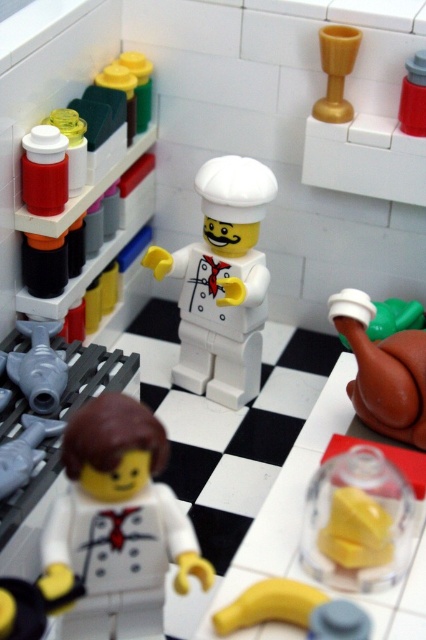
Does smooth white chef at center have a larger size compared to gold plastic cup at upper center?

Correct, smooth white chef at center is larger in size than gold plastic cup at upper center.

Is smooth white chef at center positioned before gold plastic cup at upper center?

Yes, it is.

Image resolution: width=426 pixels, height=640 pixels. In order to click on smooth white chef at center in this screenshot , I will do `click(118, 518)`.

Can you confirm if brown matte turkey at right is smaller than gold plastic cup at upper center?

No, brown matte turkey at right is not smaller than gold plastic cup at upper center.

Can you confirm if brown matte turkey at right is shorter than gold plastic cup at upper center?

→ No, brown matte turkey at right is not shorter than gold plastic cup at upper center.

Who is more forward, (411, 353) or (351, 67)?

Point (411, 353)

Find the location of a particular element. Image resolution: width=426 pixels, height=640 pixels. brown matte turkey at right is located at coordinates (382, 371).

Is white matte chef hat at center bigger than yellow rubber glove at lower left?

Yes.

Does white matte chef hat at center have a lesser height compared to yellow rubber glove at lower left?

Incorrect, white matte chef hat at center's height does not fall short of yellow rubber glove at lower left's.

Which is behind, point (158, 278) or point (2, 605)?

The point (158, 278) is more distant.

Identify the location of white matte chef hat at center. The width and height of the screenshot is (426, 640). (221, 282).